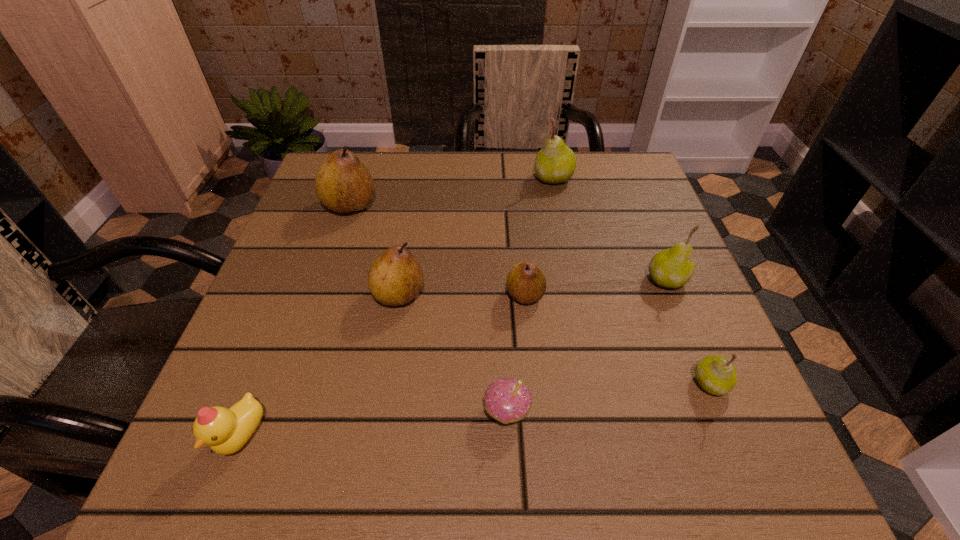
This screenshot has height=540, width=960. Find the location of `the farthest object`. the farthest object is located at coordinates click(555, 163).

At what (x,y) coordinates should I click in order to perform the action: click on the third object from right to left. Please return your answer as a coordinate pair (x, y). The width and height of the screenshot is (960, 540). Looking at the image, I should click on (555, 163).

Image resolution: width=960 pixels, height=540 pixels. What are the coordinates of `the seventh nearest object` in the screenshot? It's located at pos(343,184).

The height and width of the screenshot is (540, 960). Find the location of `the farthest brown pear`. the farthest brown pear is located at coordinates (343, 184).

Identify the location of the sixth object from right to left. This screenshot has width=960, height=540. (395, 278).

Locate an element on the screen. This screenshot has width=960, height=540. the fifth pear from right to left is located at coordinates (395, 278).

Locate an element on the screen. The height and width of the screenshot is (540, 960). the second smallest green pear is located at coordinates (672, 268).

Where is `the smallest brown pear`? The width and height of the screenshot is (960, 540). the smallest brown pear is located at coordinates (526, 283).

Image resolution: width=960 pixels, height=540 pixels. What are the coordinates of `the third pear from left to right` in the screenshot? It's located at (526, 283).

Identify the location of the smallest green pear. (716, 375).